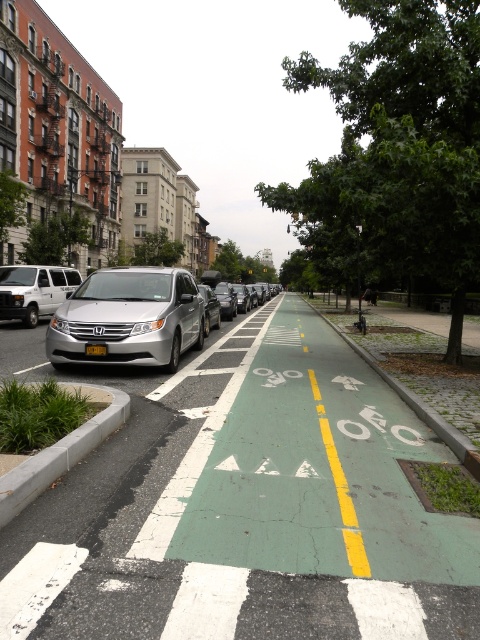
Question: Which object is farther from the camera taking this photo?

Choices:
 (A) silver metallic van at center
 (B) green concrete curb at center
 (C) silver metallic van at left
 (D) gray concrete curb at lower left

Answer: (C)

Question: Does green painted bike lane at center have a greater width compared to silver metallic van at center?

Choices:
 (A) no
 (B) yes

Answer: (B)

Question: Which point is farther to the camera?

Choices:
 (A) (236, 420)
 (B) (97, 429)
 (C) (364, 356)
 (D) (194, 333)

Answer: (C)

Question: Which point is farther to the camera?

Choices:
 (A) silver metallic van at left
 (B) silver metallic van at center
 (C) green painted bike lane at center
 (D) gray concrete curb at lower left

Answer: (A)

Question: Considering the relative positions of green painted bike lane at center and gray concrete curb at lower left in the image provided, where is green painted bike lane at center located with respect to gray concrete curb at lower left?

Choices:
 (A) below
 (B) above

Answer: (B)

Question: Can you confirm if silver metallic van at left is thinner than green concrete curb at center?

Choices:
 (A) yes
 (B) no

Answer: (A)